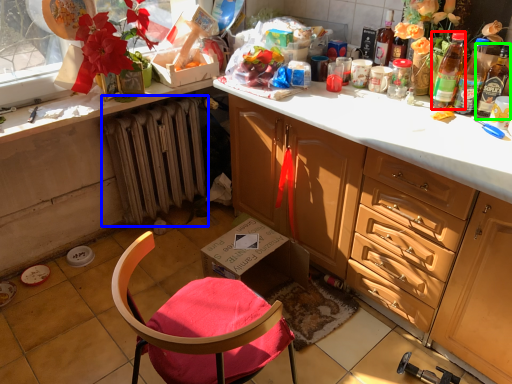
Question: Estimate the real-world distances between objects in this image. Which object is farther from bottle (highlighted by a red box), radiator (highlighted by a blue box) or bottle (highlighted by a green box)?

Choices:
 (A) radiator
 (B) bottle

Answer: (A)